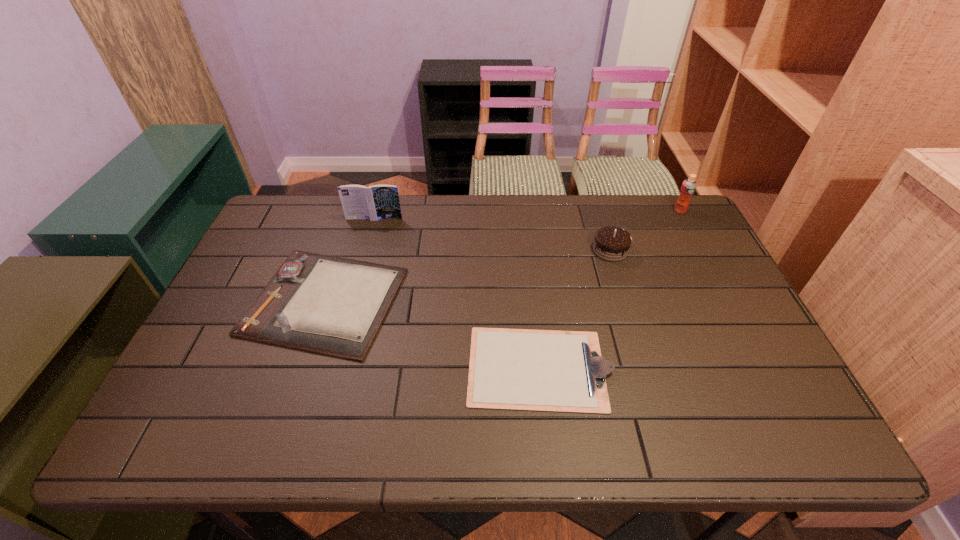
Where is `free space at the near edge`? The image size is (960, 540). free space at the near edge is located at coordinates (521, 431).

Where is `vacant region at the left edge of the desktop`? This screenshot has height=540, width=960. vacant region at the left edge of the desktop is located at coordinates (226, 299).

Where is `blank space at the right edge`? blank space at the right edge is located at coordinates (720, 323).

The height and width of the screenshot is (540, 960). Find the location of `free space at the far left corner`. free space at the far left corner is located at coordinates (318, 198).

Where is `vacant area at the near left corner of the desktop`? vacant area at the near left corner of the desktop is located at coordinates (163, 442).

At what (x,y) coordinates should I click in order to perform the action: click on free space that is in between the third object from left to right and the rightmost object. Please return your answer as a coordinate pair (x, y). Looking at the image, I should click on (610, 289).

This screenshot has height=540, width=960. I want to click on unoccupied area between the farthest object and the right clipboard, so click(x=610, y=289).

Where is `vacant space that is in between the rightmost object and the left clipboard`? vacant space that is in between the rightmost object and the left clipboard is located at coordinates (502, 256).

The height and width of the screenshot is (540, 960). I want to click on free space between the left clipboard and the third object from left to right, so click(432, 334).

Identify the location of unoccupied area between the right clipboard and the rightmost object. (610, 289).